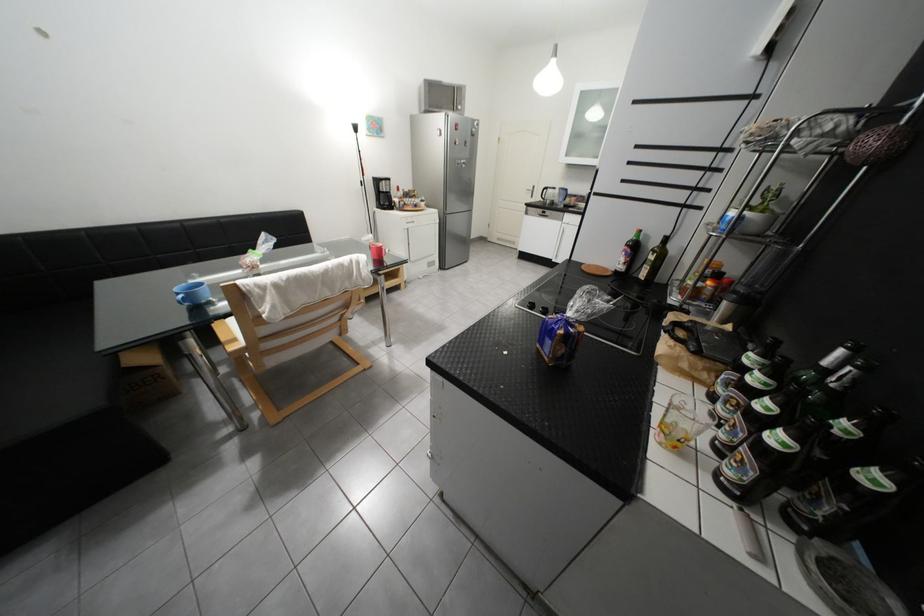
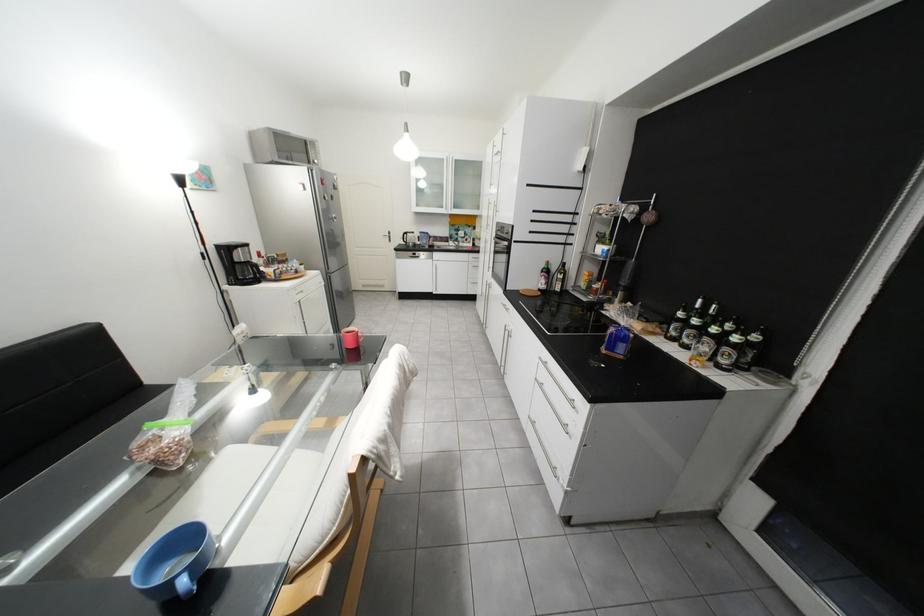
In the second image, find the point that corresponds to the point at 447,212 in the first image.

(330, 273)